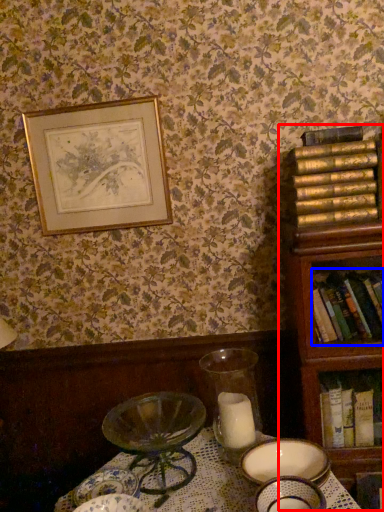
Question: Which point is closer to the camera, bookcase (highlighted by a red box) or book (highlighted by a blue box)?

Choices:
 (A) bookcase
 (B) book

Answer: (A)